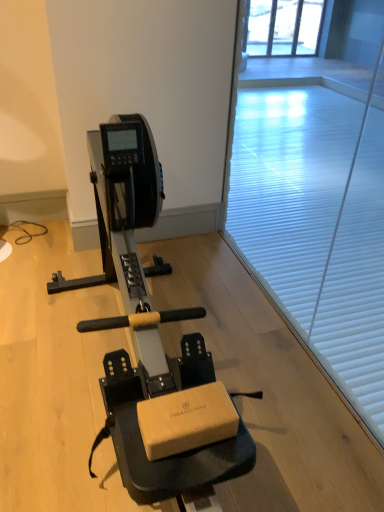
Question: From the image's perspective, is matte black stationary bicycle at center above or below white matte window screen at center?

Choices:
 (A) below
 (B) above

Answer: (A)

Question: From a real-world perspective, is matte black stationary bicycle at center above or below white matte window screen at center?

Choices:
 (A) below
 (B) above

Answer: (A)

Question: Is matte black stationary bicycle at center in front of or behind white matte window screen at center in the image?

Choices:
 (A) front
 (B) behind

Answer: (A)

Question: Visually, is white matte window screen at center positioned to the left or to the right of matte black stationary bicycle at center?

Choices:
 (A) right
 (B) left

Answer: (A)

Question: From their relative heights in the image, would you say white matte window screen at center is taller or shorter than matte black stationary bicycle at center?

Choices:
 (A) tall
 (B) short

Answer: (A)

Question: Which is correct: white matte window screen at center is inside matte black stationary bicycle at center, or outside of it?

Choices:
 (A) inside
 (B) outside

Answer: (B)

Question: Is white matte window screen at center bigger or smaller than matte black stationary bicycle at center?

Choices:
 (A) big
 (B) small

Answer: (B)